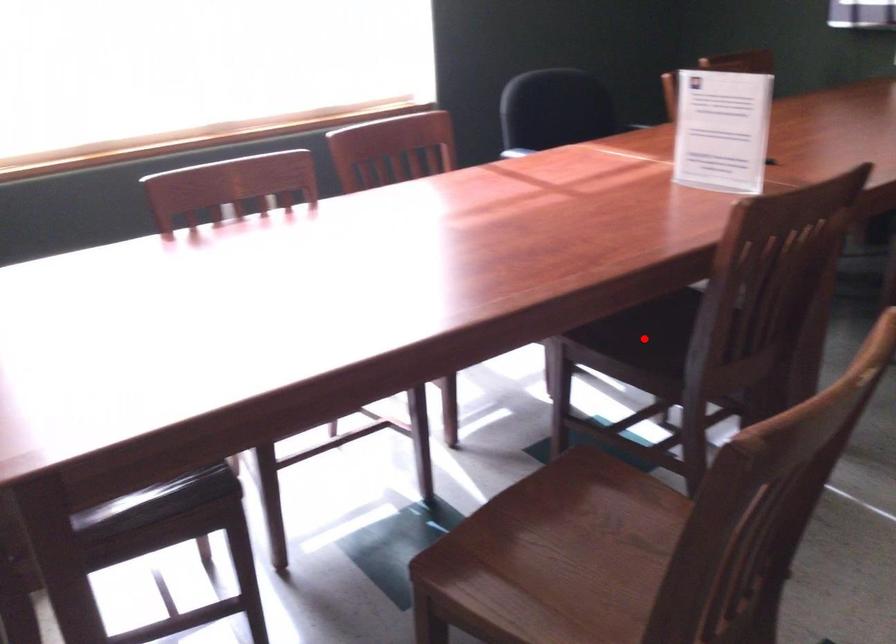
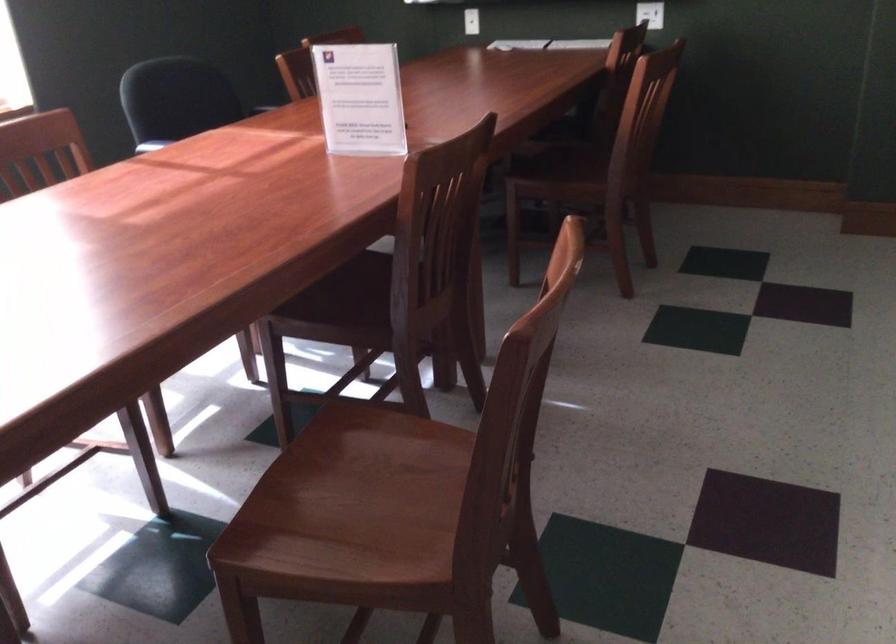
Locate, in the second image, the point that corresponds to the highlighted location in the first image.

(340, 301)